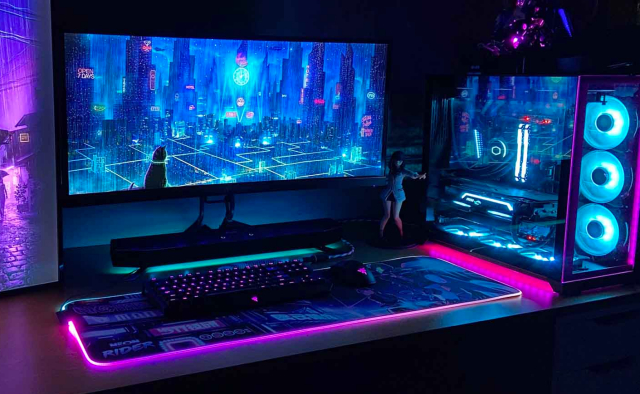
You are a GUI agent. You are given a task and a screenshot of the screen. Output one action in this format:
    pyautogui.click(x=<x>, y=<y>)
    Task: Click on the desk
    
    Given the screenshot: What is the action you would take?
    pyautogui.click(x=48, y=370)